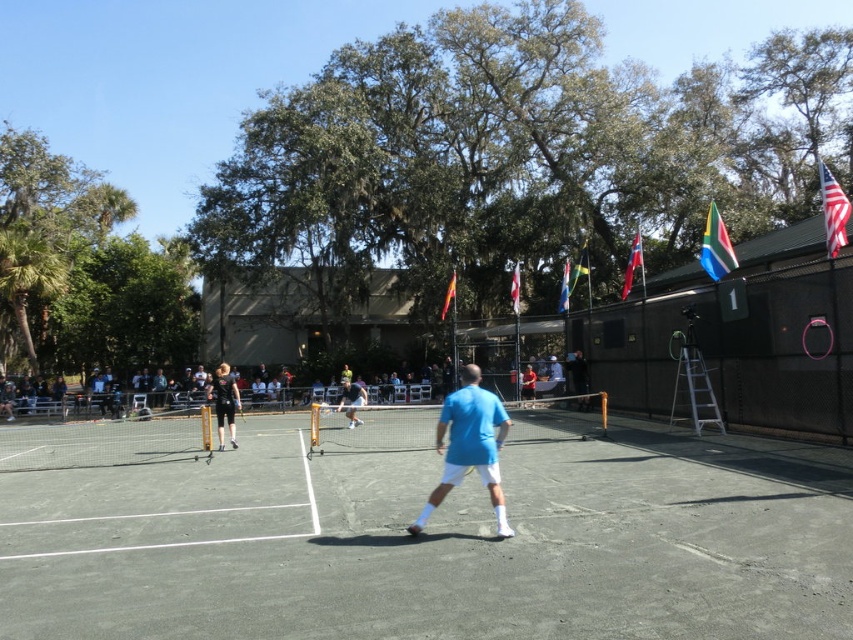
From the picture: You are a photographer standing at the center of the tennis court. You want to take a photo that includes both the green fabric flag at upper right and the red fabric flag at center. What is the minimum distance you need to move to ensure both flags are in your camera frame?

The green fabric flag at upper right and red fabric flag at center are 8.15 meters apart. To include both in your photo, you need to position yourself such that your camera frame can cover this distance. The minimum distance you need to move depends on your camera lens and field of view, but the key is to ensure both flags are within the frame. Since the flags are 8.15 meters apart, you should position yourself at a point where both are visible, likely near the center of the court where the red flag is more

You are a photographer trying to capture a photo of the concrete tennis court at center and the white fabric flag at upper center. Which object should you focus on first if you want to ensure both are in focus without adjusting the camera settings?

The concrete tennis court at center is not as tall as the white fabric flag at upper center, so you should focus on the white fabric flag at upper center first because it is farther away and requires a greater depth of field to keep both objects in focus.